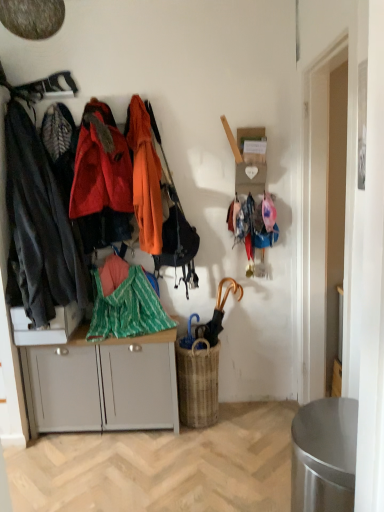
What do you see at coordinates (101, 165) in the screenshot? The image size is (384, 512). I see `orange matte jacket at left, the 2th clothing when ordered from right to left` at bounding box center [101, 165].

Describe the element at coordinates (198, 383) in the screenshot. I see `woven brown picnic basket at center` at that location.

Describe the element at coordinates (125, 303) in the screenshot. The width and height of the screenshot is (384, 512). I see `green striped fabric at center` at that location.

Where is `gold metallic umbrella at center-right`? This screenshot has width=384, height=512. gold metallic umbrella at center-right is located at coordinates (218, 312).

Can you confirm if white glossy cabinet at lower left is positioned to the left of leather handbag at center?

Indeed, white glossy cabinet at lower left is positioned on the left side of leather handbag at center.

Which object is further away from the camera taking this photo, white glossy cabinet at lower left or leather handbag at center?

white glossy cabinet at lower left is further from the camera.

From a real-world perspective, which is physically below, white glossy cabinet at lower left or leather handbag at center?

white glossy cabinet at lower left, from a real-world perspective.

Is leather handbag at center completely or partially inside white glossy cabinet at lower left?

No.

Is white matte cabinet at center wider or thinner than green striped fabric at center?

Clearly, white matte cabinet at center has less width compared to green striped fabric at center.

Is green striped fabric at center surrounded by white matte cabinet at center?

No, green striped fabric at center is not surrounded by white matte cabinet at center.

Is green striped fabric at center at the back of white matte cabinet at center?

No, white matte cabinet at center's orientation is not away from green striped fabric at center.

Is white matte cabinet at center taller than green striped fabric at center?

Yes, white matte cabinet at center is taller than green striped fabric at center.

Is orange matte jacket at left, the 2th clothing when ordered from right to left, smaller than leather handbag at center?

Actually, orange matte jacket at left, the 2th clothing when ordered from right to left, might be larger than leather handbag at center.

Can you confirm if orange matte jacket at left, which appears as the 2th clothing when viewed from the left, is positioned to the left of leather handbag at center?

Indeed, orange matte jacket at left, which appears as the 2th clothing when viewed from the left, is positioned on the left side of leather handbag at center.

From the image's perspective, which object appears higher, orange matte jacket at left, the 2th clothing when ordered from right to left, or leather handbag at center?

orange matte jacket at left, the 2th clothing when ordered from right to left, from the image's perspective.

From the picture: Considering the relative sizes of white matte cabinet at center and gold metallic umbrella at center-right in the image provided, is white matte cabinet at center taller than gold metallic umbrella at center-right?

Yes, white matte cabinet at center is taller than gold metallic umbrella at center-right.

How different are the orientations of white matte cabinet at center and gold metallic umbrella at center-right in degrees?

They differ by 3.94e-05 degrees in their facing directions.

From the image's perspective, would you say white matte cabinet at center is shown under gold metallic umbrella at center-right?

Correct, white matte cabinet at center appears lower than gold metallic umbrella at center-right in the image.

Is white glossy cabinet at lower left facing towards matte black jacket at left, positioned as the 1th clothing in left-to-right order?

No, white glossy cabinet at lower left is not turned towards matte black jacket at left, positioned as the 1th clothing in left-to-right order.

Is white glossy cabinet at lower left not inside matte black jacket at left, positioned as the 1th clothing in left-to-right order?

No, most part of white glossy cabinet at lower left lies within matte black jacket at left, positioned as the 1th clothing in left-to-right order.

In order to click on desk directly beneath the matte black jacket at left, the 3th clothing viewed from the right (from a real-world perspective) in this screenshot , I will do `click(46, 327)`.

Is white glossy cabinet at lower left wider or thinner than matte black jacket at left, positioned as the 1th clothing in left-to-right order?

Clearly, white glossy cabinet at lower left has less width compared to matte black jacket at left, positioned as the 1th clothing in left-to-right order.

Is white glossy cabinet at lower left facing towards orange matte jacket at left, the 2th clothing when ordered from right to left?

No, white glossy cabinet at lower left is not oriented towards orange matte jacket at left, the 2th clothing when ordered from right to left.

Is white glossy cabinet at lower left thinner than orange matte jacket at left, which appears as the 2th clothing when viewed from the left?

No.

Which object is closer to the camera, white glossy cabinet at lower left or orange matte jacket at left, the 2th clothing when ordered from right to left?

Positioned in front is orange matte jacket at left, the 2th clothing when ordered from right to left.

In terms of size, does white glossy cabinet at lower left appear bigger or smaller than orange matte jacket at left, the 2th clothing when ordered from right to left?

Considering their sizes, white glossy cabinet at lower left takes up less space than orange matte jacket at left, the 2th clothing when ordered from right to left.

Considering the relative positions of green striped fabric at center and white matte cabinet at center in the image provided, is green striped fabric at center to the right of white matte cabinet at center from the viewer's perspective?

Correct, you'll find green striped fabric at center to the right of white matte cabinet at center.

Considering the relative sizes of green striped fabric at center and white matte cabinet at center in the image provided, is green striped fabric at center shorter than white matte cabinet at center?

Yes, green striped fabric at center is shorter than white matte cabinet at center.

Are green striped fabric at center and white matte cabinet at center far apart?

No, green striped fabric at center is not far away from white matte cabinet at center.

From the image's perspective, is green striped fabric at center located beneath white matte cabinet at center?

No, from the image's perspective, green striped fabric at center is not beneath white matte cabinet at center.

In the image, there is a leather handbag at center. Where is `desk below it (from the image's perspective)`? This screenshot has height=512, width=384. desk below it (from the image's perspective) is located at coordinates (46, 327).

The width and height of the screenshot is (384, 512). Find the location of `jacket on the right of white matte cabinet at center`. jacket on the right of white matte cabinet at center is located at coordinates (x=125, y=303).

Which object lies further to the anchor point matte black jacket at left, positioned as the 1th clothing in left-to-right order, green striped fabric at center or white glossy cabinet at lower left?

The object further to matte black jacket at left, positioned as the 1th clothing in left-to-right order, is green striped fabric at center.

When comparing their distances from matte black jacket at left, the 3th clothing viewed from the right, does leather handbag at center or orange fabric coat at center, the third clothing in the left-to-right sequence, seem closer?

orange fabric coat at center, the third clothing in the left-to-right sequence, is positioned closer to the anchor matte black jacket at left, the 3th clothing viewed from the right.

When comparing their distances from green striped fabric at center, does white matte cabinet at center or leather handbag at center seem closer?

The object closer to green striped fabric at center is white matte cabinet at center.

Consider the image. When comparing their distances from matte black jacket at left, positioned as the 1th clothing in left-to-right order, does woven brown picnic basket at center or green striped fabric at center seem closer?

green striped fabric at center is positioned closer to the anchor matte black jacket at left, positioned as the 1th clothing in left-to-right order.

When comparing their distances from woven brown picnic basket at center, does matte black jacket at left, positioned as the 1th clothing in left-to-right order, or white matte cabinet at center seem further?

Based on the image, matte black jacket at left, positioned as the 1th clothing in left-to-right order, appears to be further to woven brown picnic basket at center.

Based on their spatial positions, is woven brown picnic basket at center or orange fabric coat at center, which appears as the 1th clothing when viewed from the right, closer to matte black jacket at left, the 3th clothing viewed from the right?

orange fabric coat at center, which appears as the 1th clothing when viewed from the right, is closer to matte black jacket at left, the 3th clothing viewed from the right.

Which object lies nearer to the anchor point woven brown picnic basket at center, leather handbag at center or gold metallic umbrella at center-right?

Based on the image, gold metallic umbrella at center-right appears to be nearer to woven brown picnic basket at center.

Considering their positions, is orange matte jacket at left, the 2th clothing when ordered from right to left, positioned further to white matte cabinet at center than white glossy cabinet at lower left?

The object further to white matte cabinet at center is orange matte jacket at left, the 2th clothing when ordered from right to left.

Locate an element on the screen. clothing between leather handbag at center and white matte cabinet at center from top to bottom is located at coordinates (38, 228).

In order to click on jacket that lies between orange fabric coat at center, the third clothing in the left-to-right sequence, and white glossy cabinet at lower left from top to bottom in this screenshot , I will do `click(125, 303)`.

I want to click on clothing between orange fabric coat at center, the third clothing in the left-to-right sequence, and white glossy cabinet at lower left, in the vertical direction, so click(x=38, y=228).

Where is `desk between orange matte jacket at left, which appears as the 2th clothing when viewed from the left, and woven brown picnic basket at center from top to bottom`? This screenshot has height=512, width=384. desk between orange matte jacket at left, which appears as the 2th clothing when viewed from the left, and woven brown picnic basket at center from top to bottom is located at coordinates (46, 327).